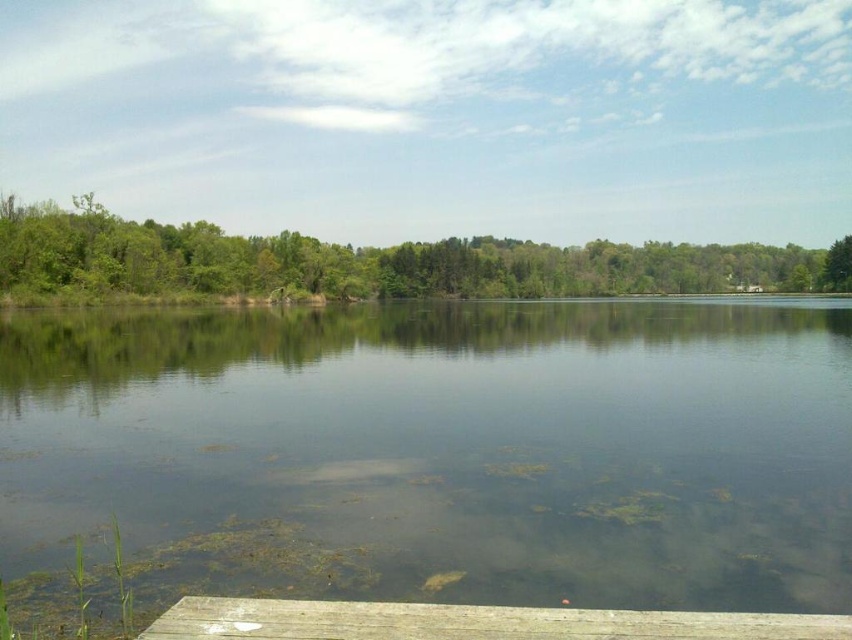
You are standing at the edge of the lake and see two points in the water, one at point coordinates point (643, 408) and the other at point coordinates point (485, 627). Which point is closer to your position?

Point (485, 627) is closer to your position because it is less further to the camera than point (643, 408).

From the picture: You are standing on the wooden dock at lower center and want to observe the clear water at center. In which direction should you look to see it?

The clear water at center is to the left of the wooden dock at lower center, so you should look to your left to see it.